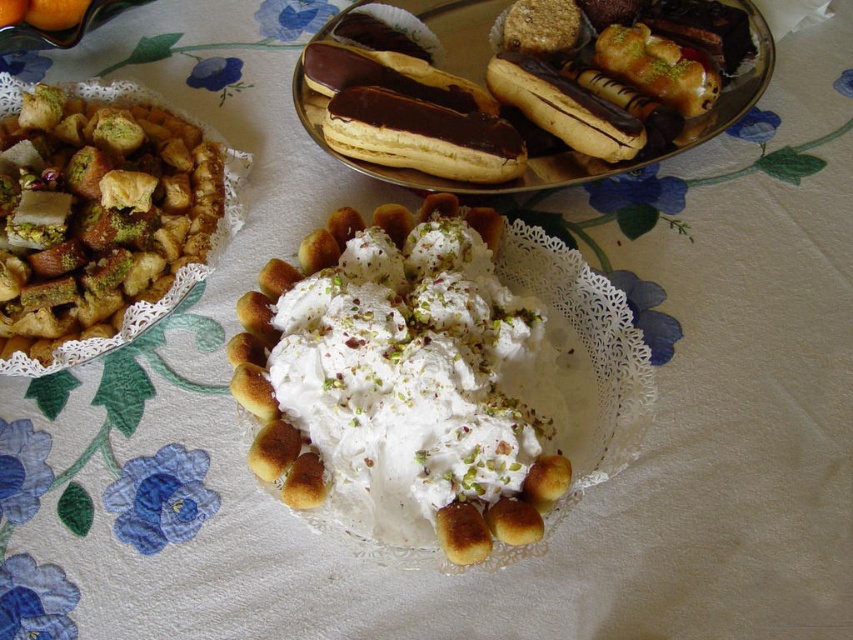
You are a food critic sitting at the table and want to reach both the creamy dessert and the nut mix. Which of the two points, point [467,19] or point [437,516], is closer to you?

Point [467,19] is closer to you because it is further to the viewer than point [437,516].

You are a food critic who needs to decide which dessert to try first based on their height. You see the pistachio crumbly pastry at left and the golden brown pastry at center. Which one is taller?

The pistachio crumbly pastry at left is much taller than the golden brown pastry at center, so you should try the pistachio crumbly pastry at left first.